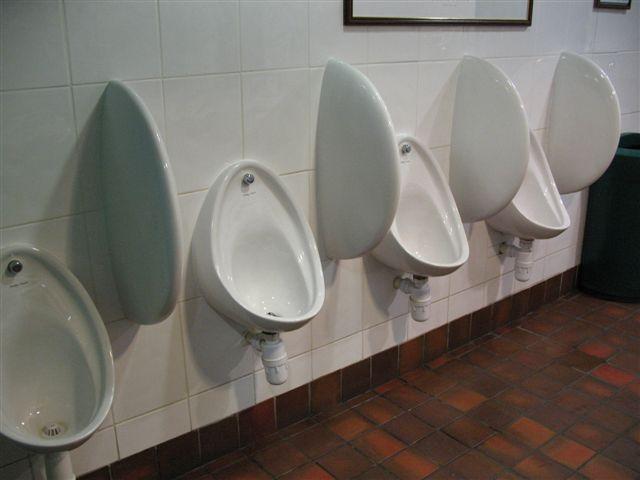
This screenshot has width=640, height=480. What are the coordinates of `garbage receptical` in the screenshot? It's located at (610, 221).